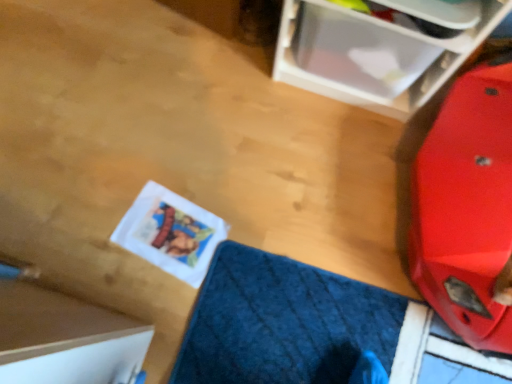
Image resolution: width=512 pixels, height=384 pixels. What do you see at coordinates (371, 55) in the screenshot? I see `transparent plastic drawer at upper right` at bounding box center [371, 55].

Measure the distance between transparent plastic drawer at upper right and camera.

transparent plastic drawer at upper right is 90.50 centimeters from camera.

Locate an element on the screen. The width and height of the screenshot is (512, 384). transparent plastic drawer at upper right is located at coordinates (371, 55).

The width and height of the screenshot is (512, 384). In order to click on transparent plastic drawer at upper right in this screenshot , I will do `click(371, 55)`.